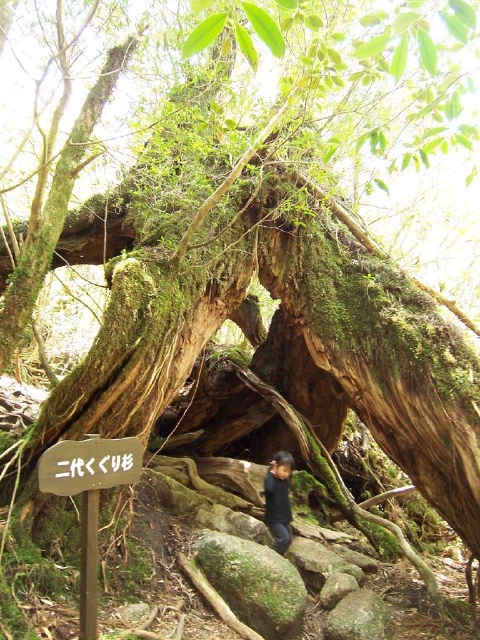
Does wooden sign at center have a lesser height compared to green mossy rock at center?

Incorrect, wooden sign at center's height does not fall short of green mossy rock at center's.

Does wooden sign at center appear over green mossy rock at center?

Yes.

What do you see at coordinates (88, 465) in the screenshot? The height and width of the screenshot is (640, 480). I see `wooden sign at center` at bounding box center [88, 465].

Where is `wooden sign at center`? wooden sign at center is located at coordinates (88, 465).

Measure the distance between point (69, 445) and camera.

2.86 meters

Who is taller, wooden sign at center or dark blue fabric at lower center?

With more height is dark blue fabric at lower center.

Which is in front, point (135, 448) or point (286, 461)?

Point (135, 448) is more forward.

At what (x,y) coordinates should I click in order to perform the action: click on wooden sign at center. Please return your answer as a coordinate pair (x, y). The height and width of the screenshot is (640, 480). Looking at the image, I should click on (88, 465).

Which is below, green mossy rock at center or dark blue fabric at lower center?

green mossy rock at center

Between green mossy rock at center and dark blue fabric at lower center, which one is positioned higher?

dark blue fabric at lower center is higher up.

Image resolution: width=480 pixels, height=640 pixels. Find the location of `green mossy rock at center`. green mossy rock at center is located at coordinates (359, 618).